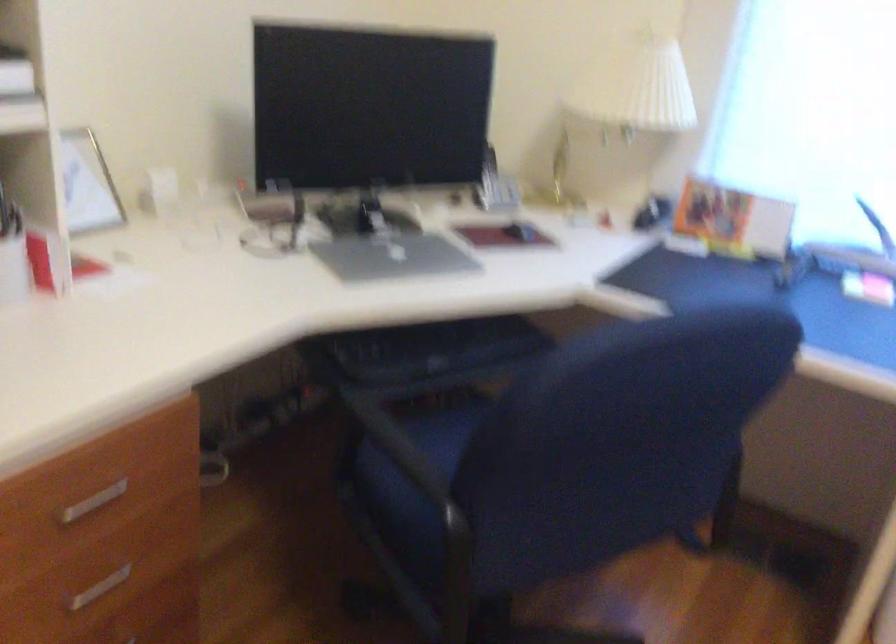
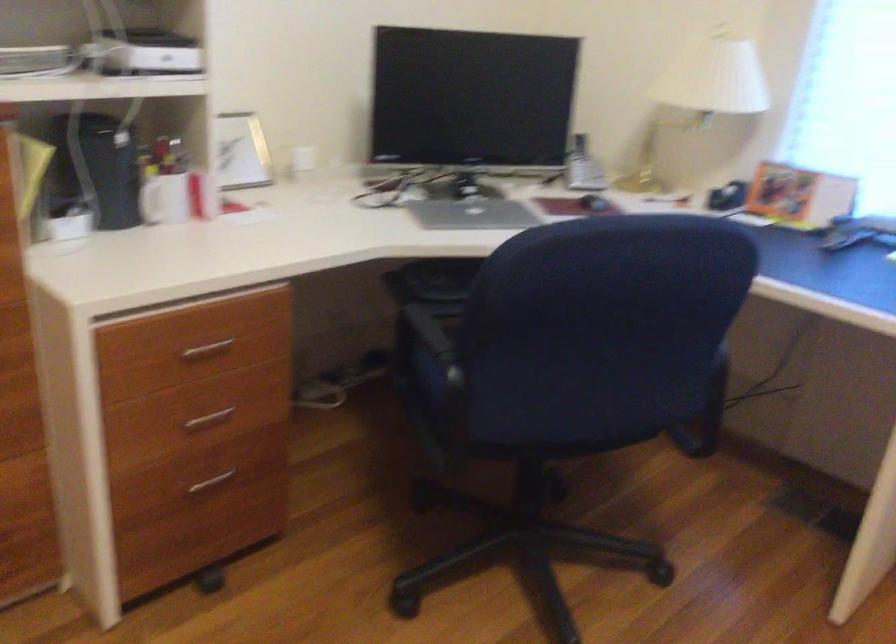
In a continuous first-person perspective shot, in which direction is the camera moving?

The movement direction of the cameraman is right, backward.